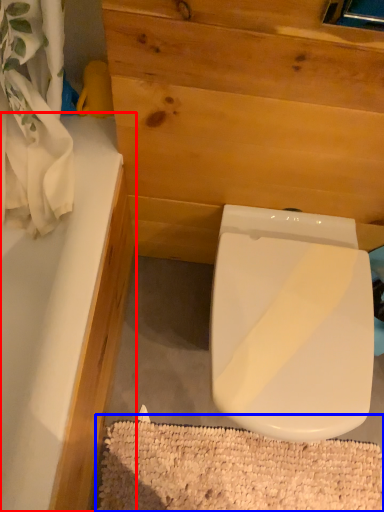
Question: Which of the following is the farthest to the observer, bathtub (highlighted by a red box) or bath mat (highlighted by a blue box)?

Choices:
 (A) bathtub
 (B) bath mat

Answer: (B)